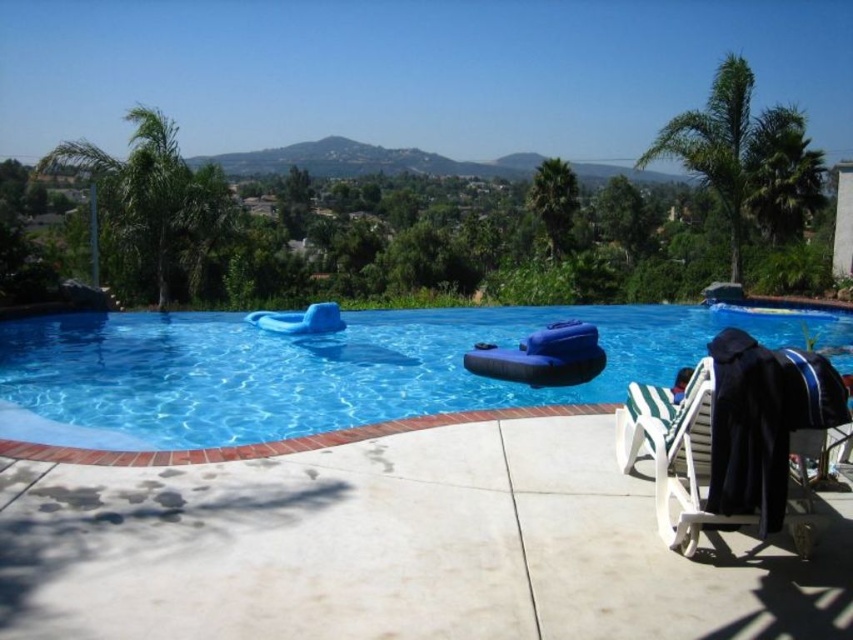
You are planning to place a new potted plant on the deck near the blue rubber float at center and the green leafy palm tree at upper center. Based on their positions, which object should you place the plant closer to if you want it to be more towards the right side of the deck?

Result: You should place the plant closer to the green leafy palm tree at upper center because the blue rubber float at center is to the left of it, meaning the palm tree is positioned further to the right.

You are standing at the center of the deck and want to find the green leafy palm tree at upper left. Based on the coordinates provided, in which direction should you look to see it?

The green leafy palm tree at upper left is located at coordinates point (154, 198), so you should look towards the upper left direction to see it.

You are planning to install a new solar panel on the roof of the house. The solar panel requires a clear space of at least 15 meters between any obstructions. Given the distance between the green leafy palm tree at upper right and the green leafy palm tree at upper left, do you think the space between them is sufficient for the solar panel installation?

The green leafy palm tree at upper right and green leafy palm tree at upper left are 14.64 meters apart, which is less than the required 15 meters. Therefore, the space between them is insufficient for the solar panel installation.